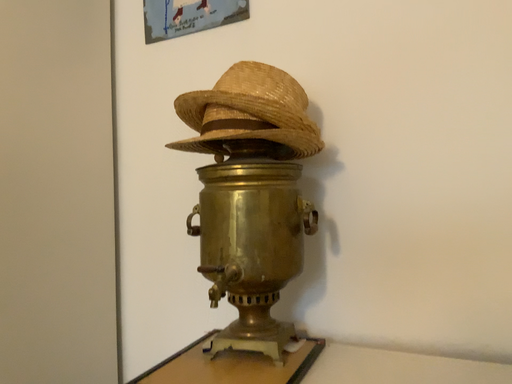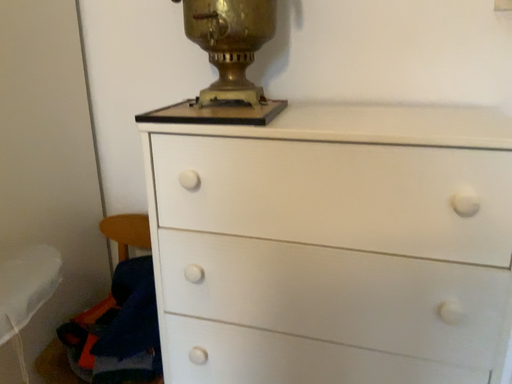
Question: Which way did the camera rotate in the video?

Choices:
 (A) rotated downward
 (B) rotated upward

Answer: (A)